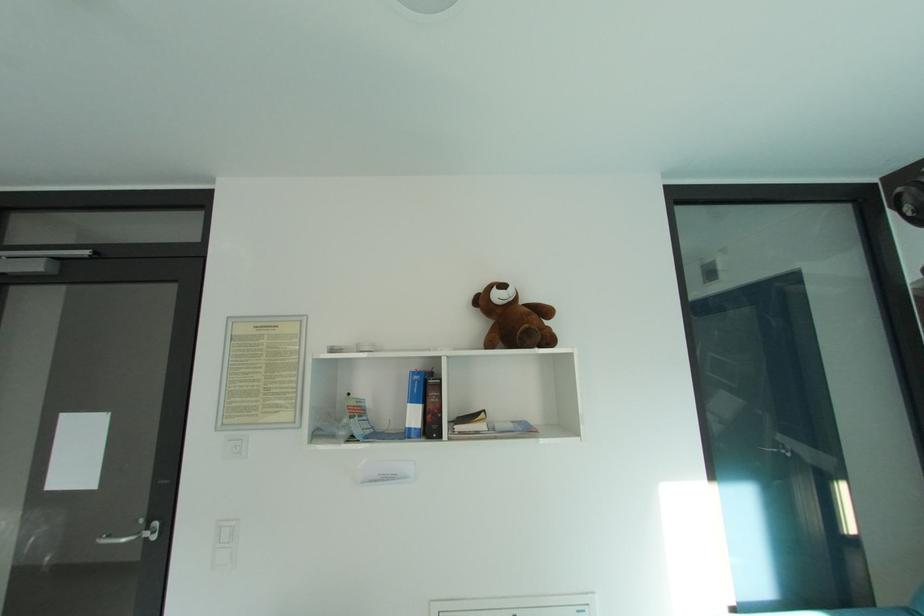
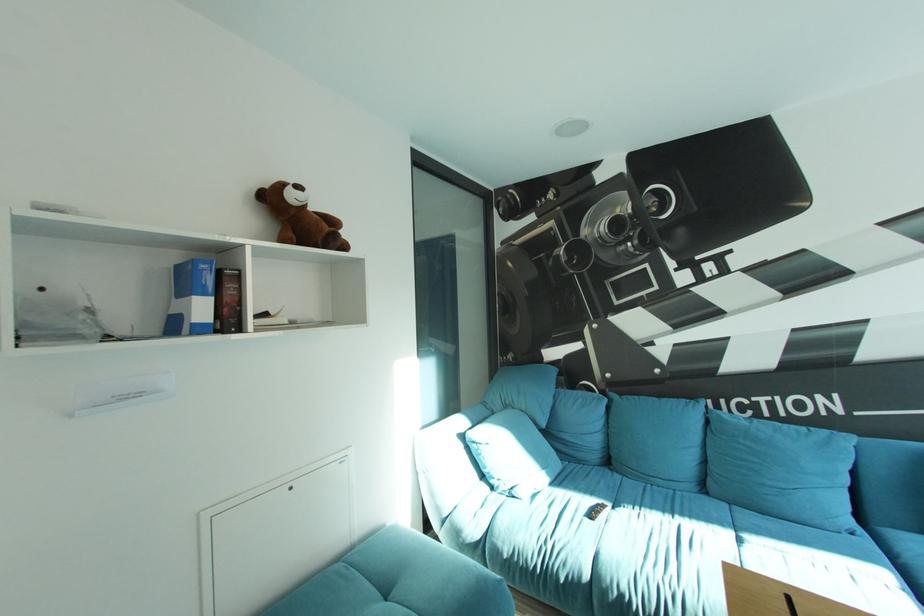
Question: The camera is either moving clockwise (left) or counter-clockwise (right) around the object. The first image is from the beginning of the video and the second image is from the end. Is the camera moving left or right when shooting the video?

Choices:
 (A) Left
 (B) Right

Answer: (A)